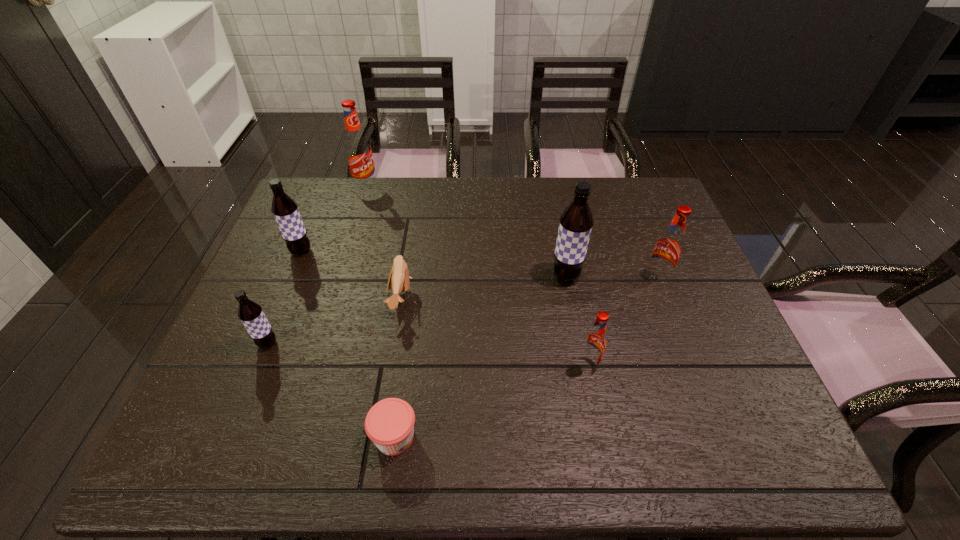
This screenshot has height=540, width=960. I want to click on the second nearest object, so click(x=594, y=344).

The width and height of the screenshot is (960, 540). Find the location of `the second red root beer from left to right`. the second red root beer from left to right is located at coordinates (594, 344).

Locate an element on the screen. bird is located at coordinates (399, 277).

You are a GUI agent. You are given a task and a screenshot of the screen. Output one action in this format:
    pyautogui.click(x=<x>, y=<y>)
    Task: Click on the jam
    This screenshot has width=960, height=540.
    Given the screenshot: What is the action you would take?
    pyautogui.click(x=390, y=422)

I want to click on the shortest object, so click(x=390, y=422).

Image resolution: width=960 pixels, height=540 pixels. I want to click on vacant space located 0.220m on the front of the third root beer from left to right, so click(x=350, y=237).

Find the location of a particular element. The height and width of the screenshot is (540, 960). free location located on the back of the biggest brown root beer is located at coordinates (x=560, y=242).

At what (x,y) coordinates should I click in order to perform the action: click on free region located 0.250m on the back of the rightmost red root beer. Please return your answer as a coordinate pair (x, y). Looking at the image, I should click on (632, 214).

Locate an element on the screen. vacant space located 0.330m on the back of the farthest brown root beer is located at coordinates (330, 180).

What are the coordinates of `vacant area situated on the right of the nearest brown root beer` in the screenshot? It's located at tap(366, 343).